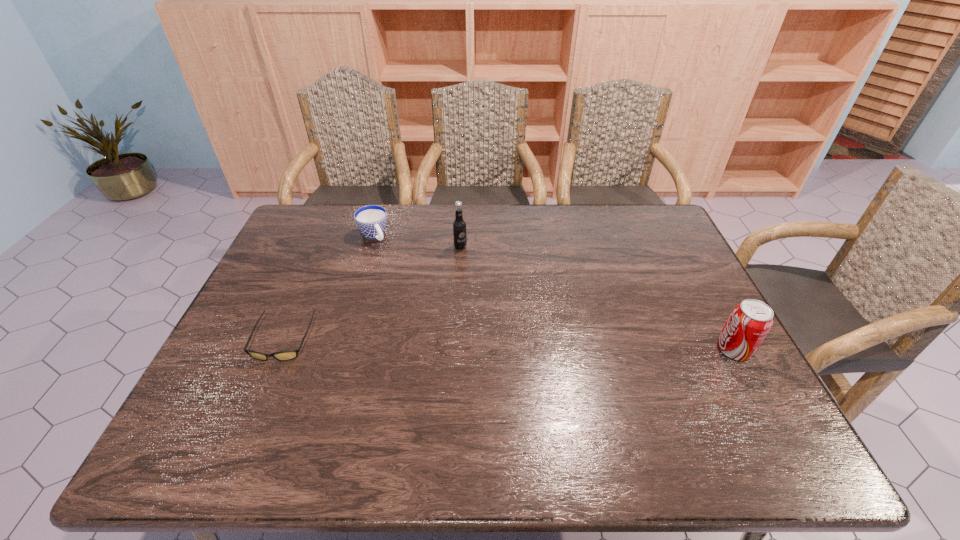
I want to click on free space between the soda and the shortest object, so click(508, 345).

This screenshot has height=540, width=960. What are the coordinates of `vacant area between the second object from right to left and the third tallest object` in the screenshot? It's located at (417, 241).

This screenshot has height=540, width=960. Find the location of `empty space between the second shortest object and the shortest object`. empty space between the second shortest object and the shortest object is located at coordinates (328, 288).

Locate an element on the screen. empty location between the shortest object and the root beer is located at coordinates 372,293.

Locate an element on the screen. Image resolution: width=960 pixels, height=540 pixels. vacant area that lies between the root beer and the second tallest object is located at coordinates (597, 299).

Locate an element on the screen. object that stands as the closest to the cup is located at coordinates (459, 225).

Where is `the closest object to the sunglasses`? This screenshot has width=960, height=540. the closest object to the sunglasses is located at coordinates (371, 220).

I want to click on free space in the image that satisfies the following two spatial constraints: 1. on the front-facing side of the leftmost object; 2. on the right side of the third shortest object, so click(278, 350).

Find the location of a particular element. free space that satisfies the following two spatial constraints: 1. on the front side of the soda; 2. on the right side of the cup is located at coordinates (340, 350).

You are a GUI agent. You are given a task and a screenshot of the screen. Output one action in this format:
    pyautogui.click(x=<x>, y=<y>)
    Task: Click on the blank space that satisfies the following two spatial constraints: 1. on the front-facing side of the leftmost object; 2. on the right side of the soda
    
    Given the screenshot: What is the action you would take?
    pyautogui.click(x=278, y=350)